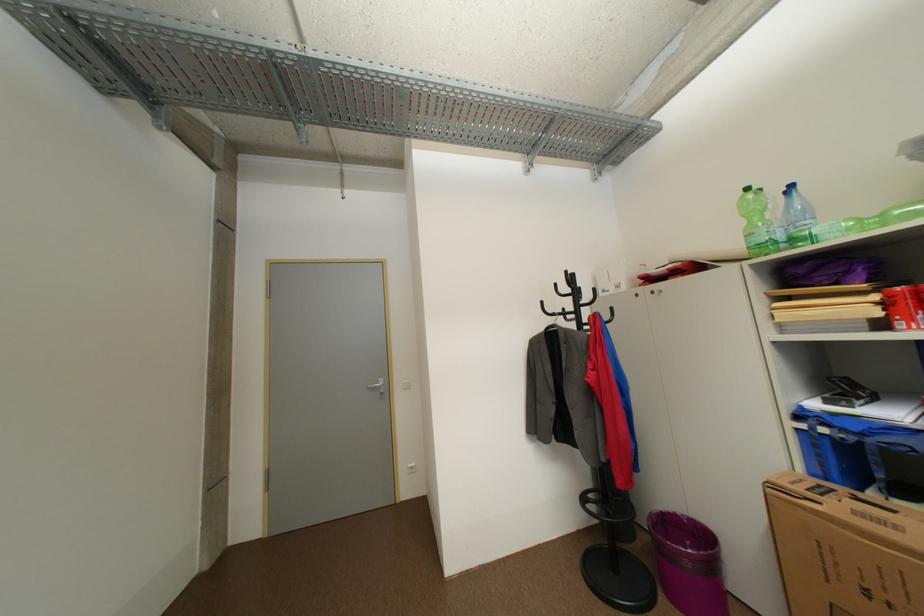
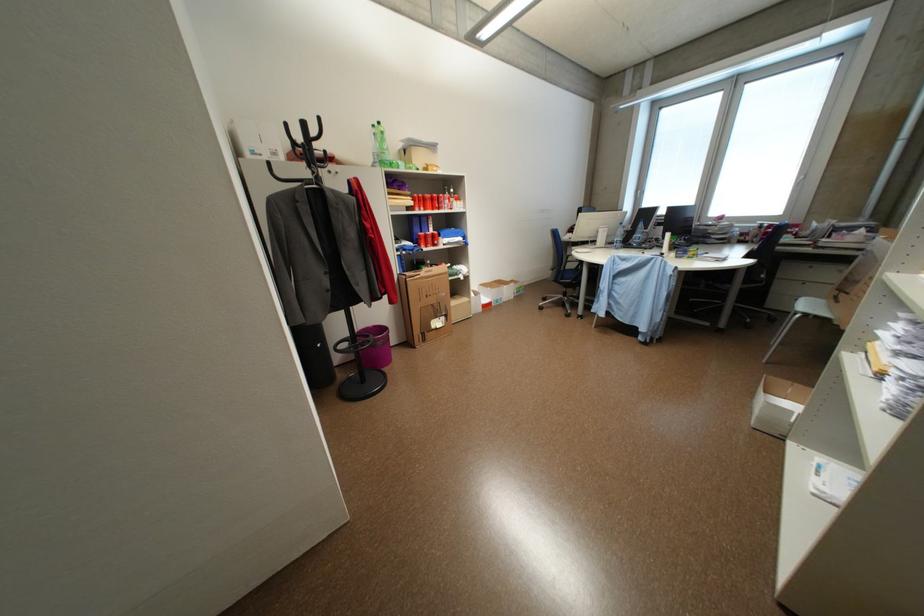
In the second image, find the point that corresponds to point 824,514 in the first image.

(428, 280)